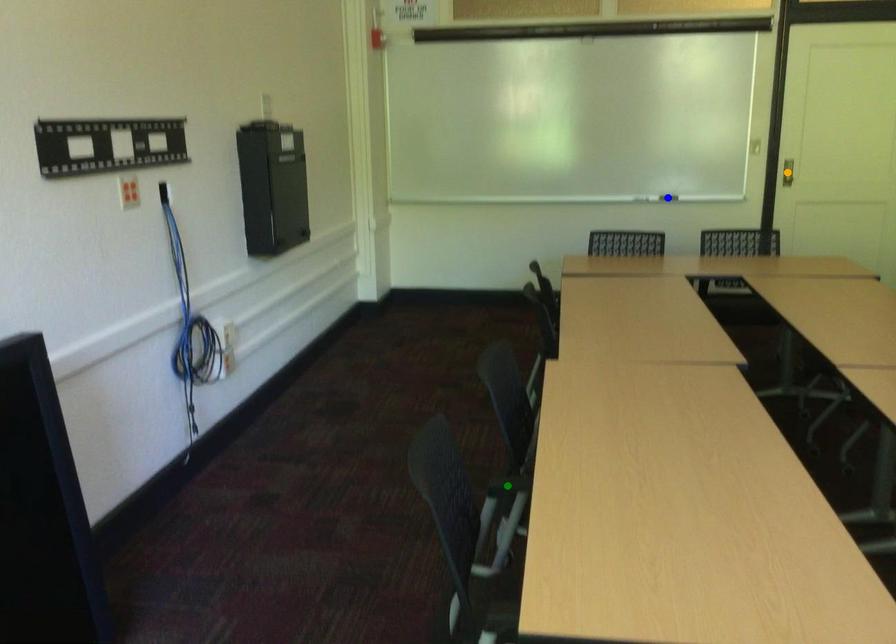
Order these from nearest to farthest:
A) blue point
B) orange point
C) green point

green point, orange point, blue point